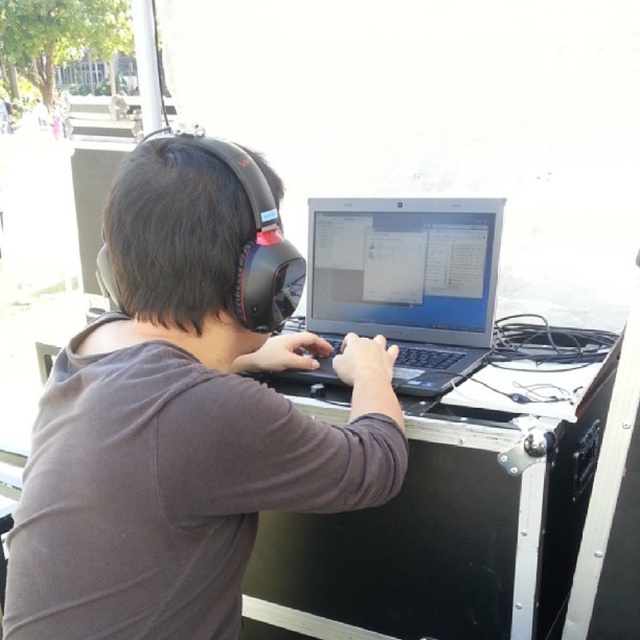
What do you see at coordinates (184, 417) in the screenshot?
I see `matte black headphones at center` at bounding box center [184, 417].

Looking at this image, is matte black headphones at center below satin black laptop at center?

Correct, matte black headphones at center is located below satin black laptop at center.

This screenshot has height=640, width=640. Describe the element at coordinates (184, 417) in the screenshot. I see `matte black headphones at center` at that location.

This screenshot has height=640, width=640. I want to click on matte black headphones at center, so click(x=184, y=417).

Can you confirm if black metal table at center is bigger than satin black laptop at center?

Indeed, black metal table at center has a larger size compared to satin black laptop at center.

Is black metal table at center further to the viewer compared to satin black laptop at center?

That is False.

What do you see at coordinates (445, 532) in the screenshot? I see `black metal table at center` at bounding box center [445, 532].

The image size is (640, 640). What are the coordinates of `black metal table at center` in the screenshot? It's located at (445, 532).

Does point (355, 428) come in front of point (342, 580)?

Yes, point (355, 428) is in front of point (342, 580).

Is matte black headphones at center shorter than black metal table at center?

Incorrect, matte black headphones at center's height does not fall short of black metal table at center's.

Where is `matte black headphones at center`? The height and width of the screenshot is (640, 640). matte black headphones at center is located at coordinates (184, 417).

Where is `matte black headphones at center`? This screenshot has height=640, width=640. matte black headphones at center is located at coordinates (184, 417).